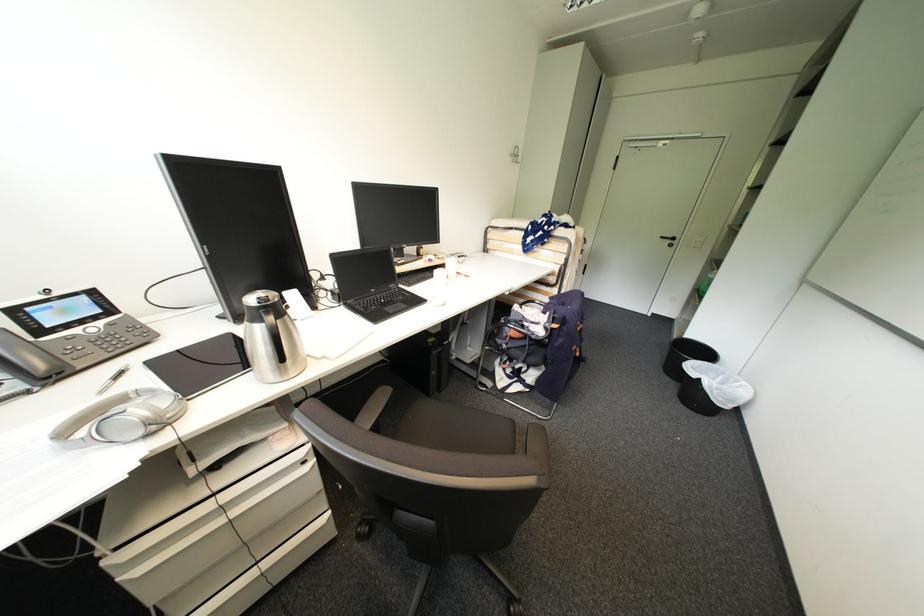
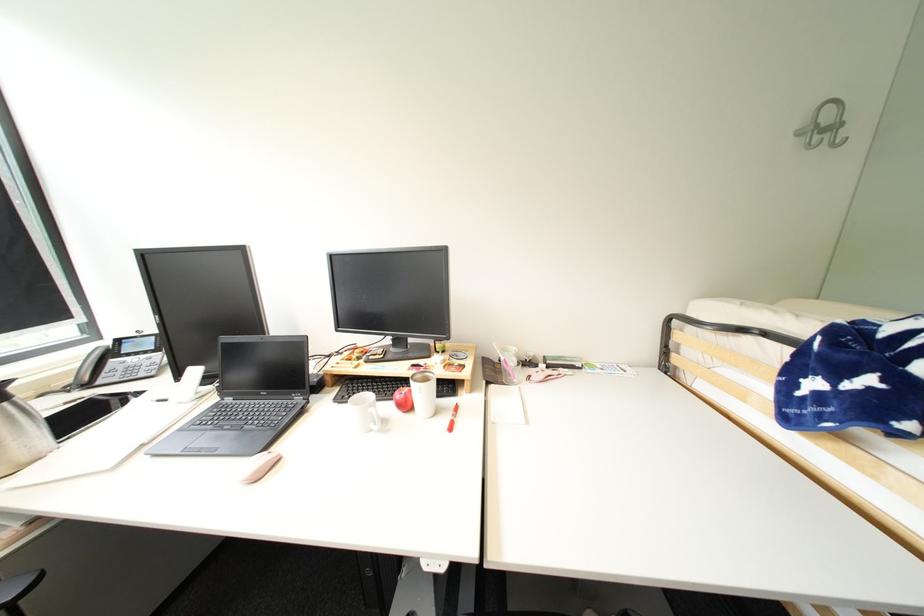
Find the pixel in the second image that matches point (524, 158) in the first image.

(841, 128)